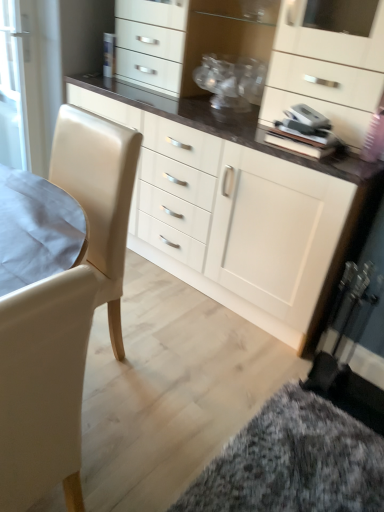
Question: Can you confirm if leather-like white swivel chair at left is taller than matte white cabinet at center?

Choices:
 (A) no
 (B) yes

Answer: (A)

Question: Is matte white cabinet at center a part of leather-like white swivel chair at left?

Choices:
 (A) no
 (B) yes

Answer: (A)

Question: Is leather-like white swivel chair at left positioned before matte white cabinet at center?

Choices:
 (A) yes
 (B) no

Answer: (A)

Question: Is leather-like white swivel chair at left oriented towards matte white cabinet at center?

Choices:
 (A) no
 (B) yes

Answer: (A)

Question: From the image's perspective, is leather-like white swivel chair at left on matte white cabinet at center?

Choices:
 (A) yes
 (B) no

Answer: (B)

Question: From the image's perspective, is leather-like white swivel chair at left below matte white cabinet at center?

Choices:
 (A) yes
 (B) no

Answer: (A)

Question: Would you say leather-like white swivel chair at left is part of fluffy carpet at lower right's contents?

Choices:
 (A) no
 (B) yes

Answer: (A)

Question: From the image's perspective, would you say fluffy carpet at lower right is positioned over leather-like white swivel chair at left?

Choices:
 (A) yes
 (B) no

Answer: (B)

Question: From a real-world perspective, is fluffy carpet at lower right located higher than leather-like white swivel chair at left?

Choices:
 (A) yes
 (B) no

Answer: (B)

Question: Considering the relative positions of fluffy carpet at lower right and leather-like white swivel chair at left in the image provided, is fluffy carpet at lower right to the left of leather-like white swivel chair at left from the viewer's perspective?

Choices:
 (A) no
 (B) yes

Answer: (A)

Question: Is fluffy carpet at lower right shorter than leather-like white swivel chair at left?

Choices:
 (A) yes
 (B) no

Answer: (A)

Question: Does fluffy carpet at lower right appear on the right side of leather-like white swivel chair at left?

Choices:
 (A) yes
 (B) no

Answer: (A)

Question: Is leather-like white swivel chair at left outside fluffy carpet at lower right?

Choices:
 (A) yes
 (B) no

Answer: (A)